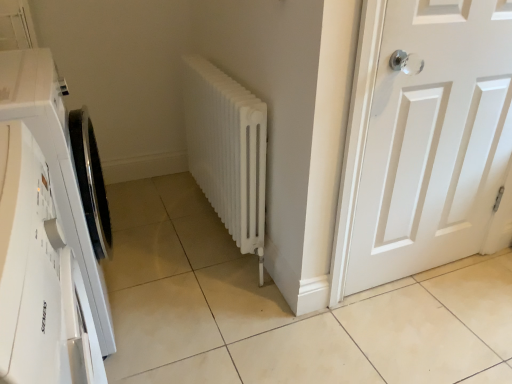
The width and height of the screenshot is (512, 384). What do you see at coordinates (434, 140) in the screenshot?
I see `white matte door at right` at bounding box center [434, 140].

I want to click on white matte/waterproof washing machine at left, so click(x=44, y=237).

This screenshot has width=512, height=384. What do you see at coordinates (44, 237) in the screenshot? I see `white matte/waterproof washing machine at left` at bounding box center [44, 237].

The image size is (512, 384). I want to click on white matte door at right, so pos(434,140).

Can you confirm if white matte radiator at center is taller than white matte/waterproof washing machine at left?

In fact, white matte radiator at center may be shorter than white matte/waterproof washing machine at left.

From the picture: How different are the orientations of white matte radiator at center and white matte/waterproof washing machine at left in degrees?

white matte radiator at center and white matte/waterproof washing machine at left are facing 180 degrees away from each other.

Could you measure the distance between white matte radiator at center and white matte/waterproof washing machine at left?

A distance of 65.47 centimeters exists between white matte radiator at center and white matte/waterproof washing machine at left.

From the image's perspective, relative to white matte/waterproof washing machine at left, is white matte radiator at center above or below?

Clearly, from the image's perspective, white matte radiator at center is above white matte/waterproof washing machine at left.

Which is correct: white matte radiator at center is inside white matte door at right, or outside of it?

white matte radiator at center lies outside white matte door at right.

Is white matte radiator at center not near white matte door at right?

That's not correct — white matte radiator at center is a little close to white matte door at right.

How many degrees apart are the facing directions of white matte radiator at center and white matte door at right?

The facing directions of white matte radiator at center and white matte door at right are 90.7 degrees apart.

In terms of width, does white matte radiator at center look wider or thinner when compared to white matte door at right?

white matte radiator at center is wider than white matte door at right.

From a real-world perspective, between white matte/waterproof washing machine at left and white matte door at right, who is vertically higher?

→ white matte door at right, from a real-world perspective.

What's the angular difference between white matte/waterproof washing machine at left and white matte door at right's facing directions?

There is a 89.5-degree angle between the facing directions of white matte/waterproof washing machine at left and white matte door at right.

Find the location of a particular element. door that is above the white matte/waterproof washing machine at left (from the image's perspective) is located at coordinates (434, 140).

Is white matte/waterproof washing machine at left taller or shorter than white matte door at right?

In the image, white matte/waterproof washing machine at left appears to be shorter than white matte door at right.

Is white matte/waterproof washing machine at left far away from white matte radiator at center?

white matte/waterproof washing machine at left is near white matte radiator at center, not far away.

From a real-world perspective, between white matte/waterproof washing machine at left and white matte radiator at center, who is vertically lower?

white matte radiator at center, from a real-world perspective.

Which object is further away from the camera taking this photo, white matte/waterproof washing machine at left or white matte radiator at center?

white matte radiator at center is more distant.

Considering the positions of points (73, 203) and (220, 101), is point (73, 203) farther from camera compared to point (220, 101)?

No, (73, 203) is in front of (220, 101).

Which object is positioned more to the left, white matte door at right or white matte/waterproof washing machine at left?

white matte/waterproof washing machine at left.

Would you say white matte door at right is outside white matte/waterproof washing machine at left?

Yes, white matte door at right is outside of white matte/waterproof washing machine at left.

Considering the relative sizes of white matte door at right and white matte/waterproof washing machine at left in the image provided, is white matte door at right thinner than white matte/waterproof washing machine at left?

Yes, white matte door at right is thinner than white matte/waterproof washing machine at left.

From the image's perspective, between white matte door at right and white matte/waterproof washing machine at left, who is located below?

white matte/waterproof washing machine at left appears lower in the image.

The height and width of the screenshot is (384, 512). I want to click on radiator below the white matte door at right (from a real-world perspective), so click(227, 150).

Is white matte door at right thinner than white matte radiator at center?

Yes, white matte door at right is thinner than white matte radiator at center.

From the image's perspective, between white matte door at right and white matte radiator at center, who is located below?

white matte door at right.

Is white matte door at right taller or shorter than white matte radiator at center?

Clearly, white matte door at right is taller compared to white matte radiator at center.

Where is `radiator below the white matte/waterproof washing machine at left (from a real-world perspective)`? radiator below the white matte/waterproof washing machine at left (from a real-world perspective) is located at coordinates (x=227, y=150).

Where is `door to the right of white matte radiator at center`? door to the right of white matte radiator at center is located at coordinates (x=434, y=140).

From the picture: Based on their spatial positions, is white matte door at right or white matte radiator at center further from white matte/waterproof washing machine at left?

white matte door at right is further to white matte/waterproof washing machine at left.

Based on their spatial positions, is white matte radiator at center or white matte door at right further from white matte/waterproof washing machine at left?

The object further to white matte/waterproof washing machine at left is white matte door at right.

Based on their spatial positions, is white matte radiator at center or white matte/waterproof washing machine at left further from white matte door at right?

white matte/waterproof washing machine at left is positioned further to the anchor white matte door at right.

Considering their positions, is white matte/waterproof washing machine at left positioned further to white matte radiator at center than white matte door at right?

white matte/waterproof washing machine at left is positioned further to the anchor white matte radiator at center.

Which object lies further to the anchor point white matte radiator at center, white matte door at right or white matte/waterproof washing machine at left?

Based on the image, white matte/waterproof washing machine at left appears to be further to white matte radiator at center.

Considering their positions, is white matte/waterproof washing machine at left positioned closer to white matte door at right than white matte radiator at center?

white matte radiator at center.

Where is `radiator between white matte/waterproof washing machine at left and white matte door at right`? This screenshot has width=512, height=384. radiator between white matte/waterproof washing machine at left and white matte door at right is located at coordinates (227, 150).